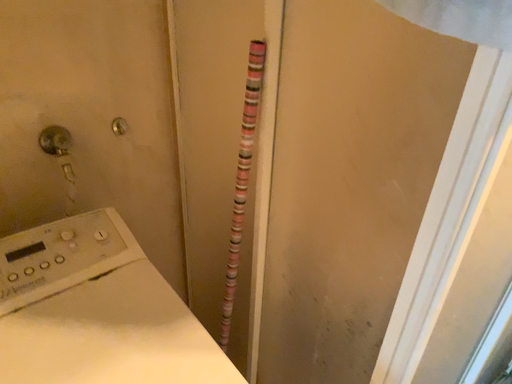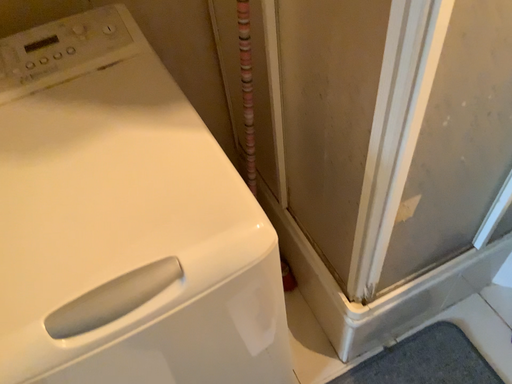
Question: How did the camera likely rotate when shooting the video?

Choices:
 (A) rotated right
 (B) rotated left

Answer: (B)